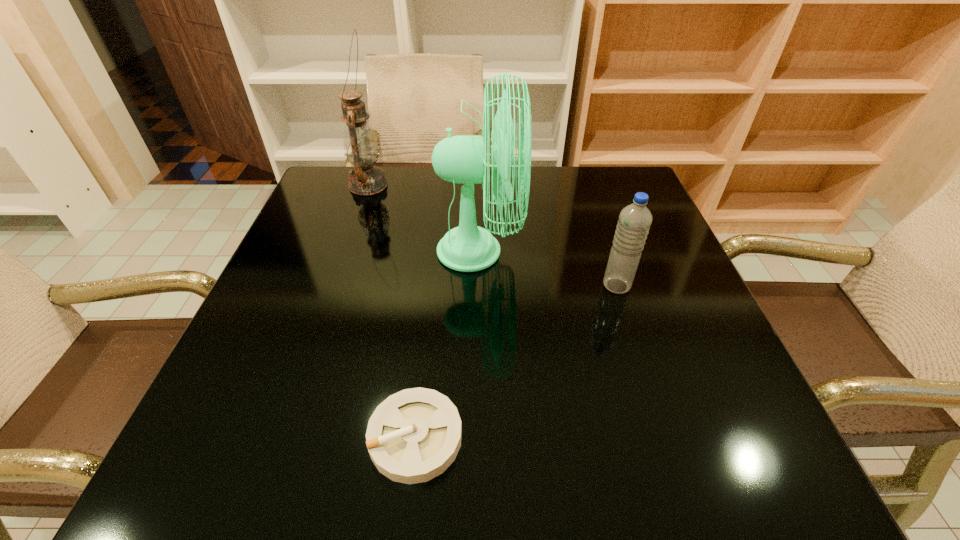
The width and height of the screenshot is (960, 540). I want to click on vacant space at the right edge of the desktop, so click(x=642, y=266).

Find the location of a particular element. vacant region at the far left corner of the desktop is located at coordinates point(331,178).

This screenshot has height=540, width=960. What are the coordinates of `free location at the near left corner of the desktop` in the screenshot? It's located at (256, 471).

Locate an element on the screen. Image resolution: width=960 pixels, height=540 pixels. free region at the far right corner of the desktop is located at coordinates (609, 198).

The height and width of the screenshot is (540, 960). What are the coordinates of `vacant space at the near right corner of the desktop` in the screenshot? It's located at (703, 443).

The width and height of the screenshot is (960, 540). Find the location of `free space between the fan and the second shortest object`. free space between the fan and the second shortest object is located at coordinates (547, 268).

Find the location of `vacant area that lies between the fan and the oil lamp`. vacant area that lies between the fan and the oil lamp is located at coordinates (423, 218).

Locate an element on the screen. The image size is (960, 540). empty location between the oil lamp and the rightmost object is located at coordinates (492, 235).

Locate an element on the screen. free point between the oil lamp and the nearest object is located at coordinates (392, 311).

The image size is (960, 540). In order to click on empty space between the shortest object and the oil lamp in this screenshot , I will do `click(392, 311)`.